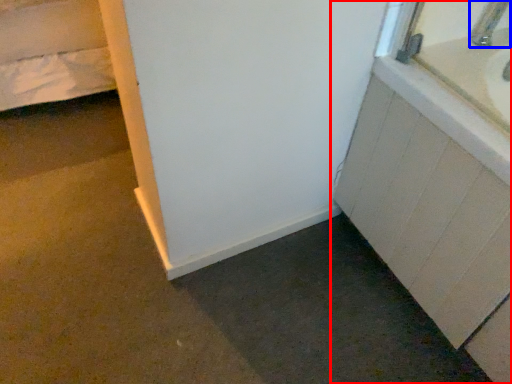
Question: Which object appears closest to the camera in this image, bathroom cabinet (highlighted by a red box) or faucet (highlighted by a blue box)?

Choices:
 (A) bathroom cabinet
 (B) faucet

Answer: (A)